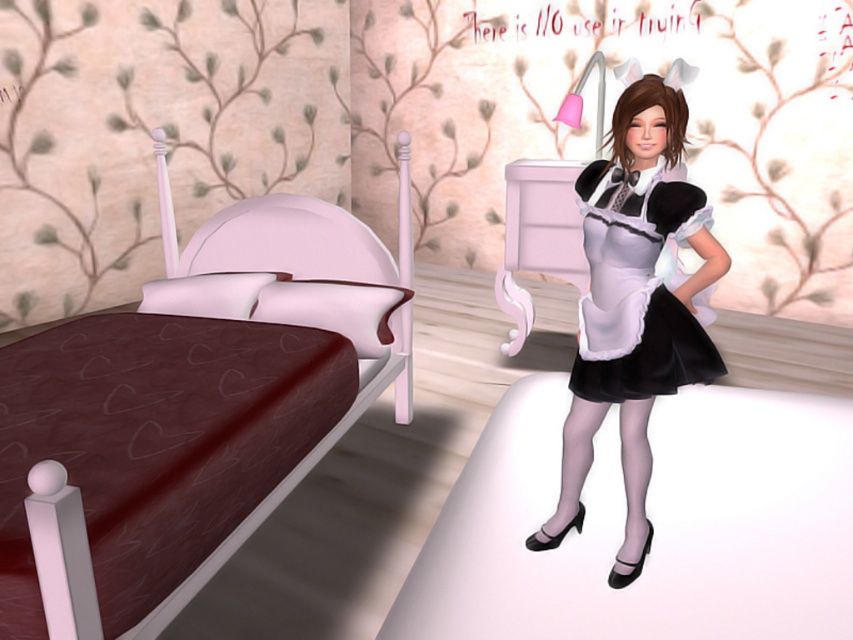
Question: Does brown fabric bed at center have a larger size compared to matte black maid outfit at center?

Choices:
 (A) no
 (B) yes

Answer: (B)

Question: Which of the following is the closest to the observer?

Choices:
 (A) matte black maid outfit at center
 (B) black satin dress at center

Answer: (A)

Question: Which point appears farthest from the camera in this image?

Choices:
 (A) (247, 289)
 (B) (628, 211)

Answer: (A)

Question: Can you confirm if matte black maid outfit at center is positioned to the right of black satin dress at center?

Choices:
 (A) no
 (B) yes

Answer: (B)

Question: Which of these objects is positioned closest to the brown fabric bed at center?

Choices:
 (A) black satin dress at center
 (B) matte black maid outfit at center

Answer: (A)

Question: Is matte black maid outfit at center closer to the viewer compared to black satin dress at center?

Choices:
 (A) no
 (B) yes

Answer: (B)